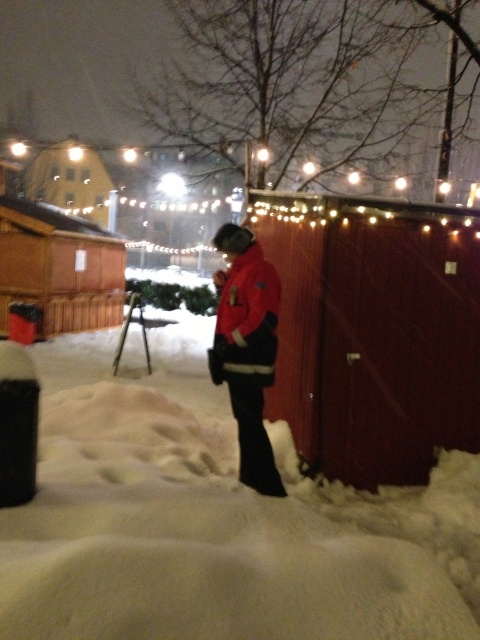
You are a visitor at a winter market and want to take a photo of the wooden hut at upper left without any snow in the frame. Which direction should you move to ensure the white fluffy snow at lower center is no longer visible?

Move to the left side of the wooden hut at upper left so that the white fluffy snow at lower center, which is to the right of the wooden hut at upper left, becomes out of the frame.